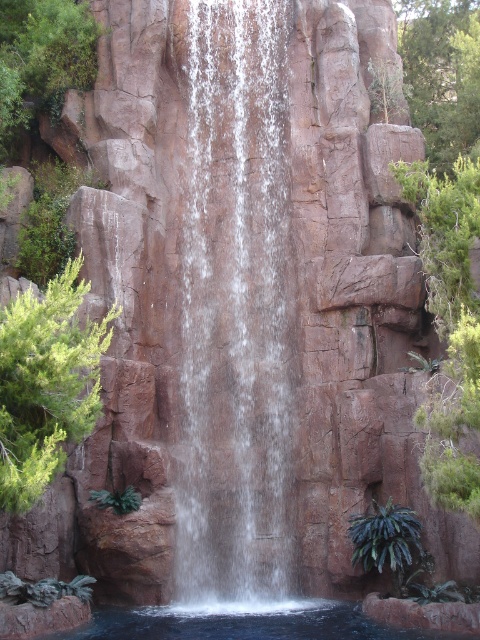
You are standing at the base of the waterfall and want to take a photo of the green leafy tree at left and the green leafy plant at upper left. Which one will appear closer to the camera in the photo?

The green leafy tree at left will appear closer to the camera because it is in front of the green leafy plant at upper left.